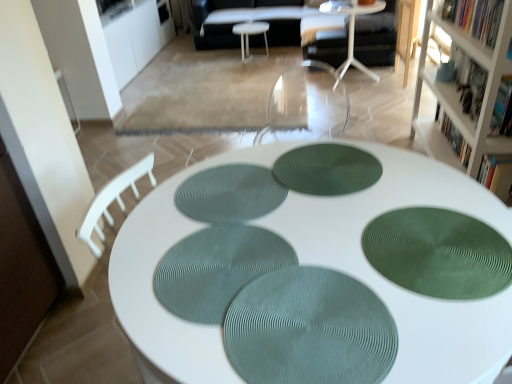
Question: Which is correct: hardcover book at upper right, which is the 1th book from front to back, is inside white fabric couch at center, or outside of it?

Choices:
 (A) outside
 (B) inside

Answer: (A)

Question: Is point (492, 122) closer or farther from the camera than point (227, 34)?

Choices:
 (A) farther
 (B) closer

Answer: (B)

Question: Considering the real-world distances, which object is farthest from the white fabric couch at center?

Choices:
 (A) hardcover book at upper right, placed as the 1th book when sorted from back to front
 (B) green textured placemat at center, the 2th mat viewed from the right
 (C) green matte bookshelf at upper right, the 2th book when ordered from back to front
 (D) teal textured placemat at center, the third mat viewed from the right
 (E) green textured mat at lower right, acting as the fourth mat starting from the left

Answer: (D)

Question: Considering the real-world distances, which object is farthest from the white wood bookshelf at upper right?

Choices:
 (A) hardcover book at upper right, which is the 3th book in back-to-front order
 (B) green textured placemat at center, which is the first mat from left to right
 (C) teal textured placemat at center, the second mat positioned from the left
 (D) green textured mat at lower right, acting as the fourth mat starting from the left
 (E) green textured placemat at center, marked as the 3th mat in a left-to-right arrangement

Answer: (C)